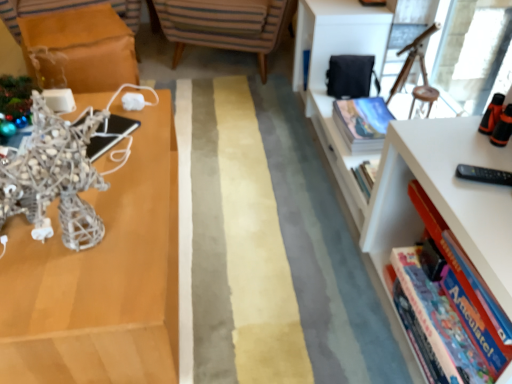
Question: Can you confirm if white plastic bookcase at right is bigger than striped fabric chair at center?

Choices:
 (A) no
 (B) yes

Answer: (B)

Question: Is white plastic bookcase at right positioned before striped fabric chair at center?

Choices:
 (A) no
 (B) yes

Answer: (B)

Question: Is the position of white plastic bookcase at right more distant than that of striped fabric chair at center?

Choices:
 (A) yes
 (B) no

Answer: (B)

Question: Could you tell me if white plastic bookcase at right is facing striped fabric chair at center?

Choices:
 (A) yes
 (B) no

Answer: (B)

Question: Is white plastic bookcase at right facing away from striped fabric chair at center?

Choices:
 (A) no
 (B) yes

Answer: (A)

Question: Does white plastic bookcase at right have a greater height compared to striped fabric chair at center?

Choices:
 (A) yes
 (B) no

Answer: (A)

Question: From the image's perspective, is hardcover book at upper right, the second book in the bottom-to-top sequence, over matte silver sculpture at left?

Choices:
 (A) yes
 (B) no

Answer: (A)

Question: Considering the relative sizes of hardcover book at upper right, marked as the 1th book in a top-to-bottom arrangement, and matte silver sculpture at left in the image provided, is hardcover book at upper right, marked as the 1th book in a top-to-bottom arrangement, taller than matte silver sculpture at left?

Choices:
 (A) no
 (B) yes

Answer: (A)

Question: Is hardcover book at upper right, the second book in the bottom-to-top sequence, oriented towards matte silver sculpture at left?

Choices:
 (A) yes
 (B) no

Answer: (A)

Question: Does hardcover book at upper right, marked as the 1th book in a top-to-bottom arrangement, touch matte silver sculpture at left?

Choices:
 (A) no
 (B) yes

Answer: (A)

Question: Does hardcover book at upper right, the second book in the bottom-to-top sequence, have a larger size compared to matte silver sculpture at left?

Choices:
 (A) no
 (B) yes

Answer: (A)

Question: From the image's perspective, is hardcover book at upper right, the second book in the bottom-to-top sequence, located beneath matte silver sculpture at left?

Choices:
 (A) no
 (B) yes

Answer: (A)

Question: Considering the relative sizes of white plastic bookcase at right and matte silver sculpture at left in the image provided, is white plastic bookcase at right taller than matte silver sculpture at left?

Choices:
 (A) yes
 (B) no

Answer: (A)